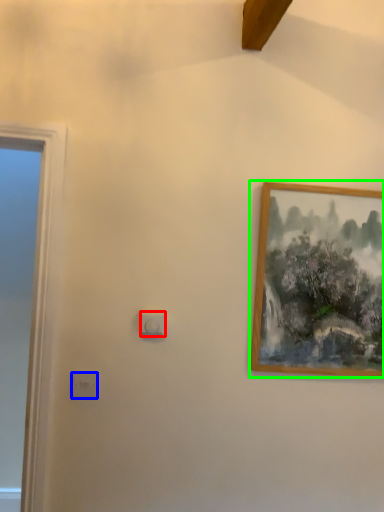
Question: Which is farther away from light switch (highlighted by a red box)? light switch (highlighted by a blue box) or picture frame (highlighted by a green box)?

Choices:
 (A) light switch
 (B) picture frame

Answer: (B)